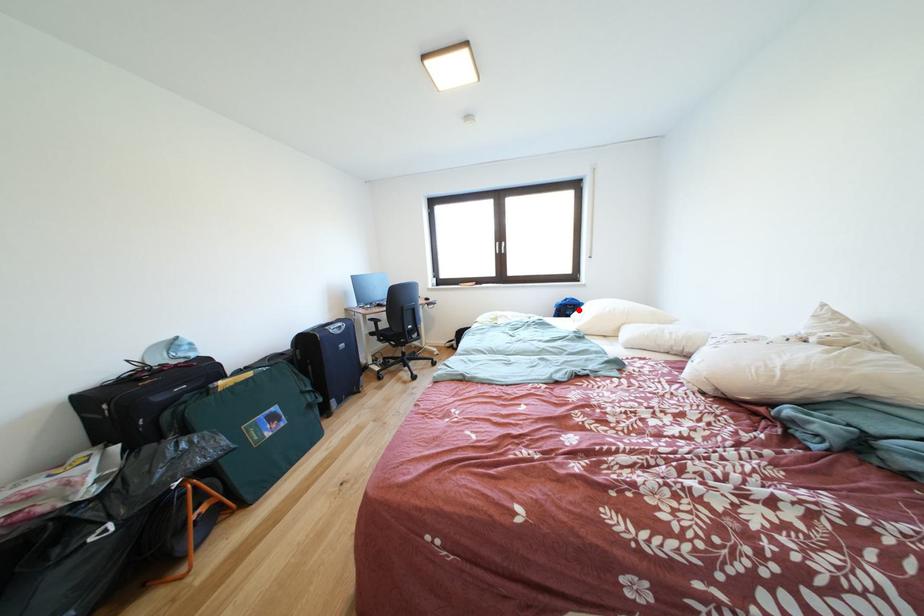
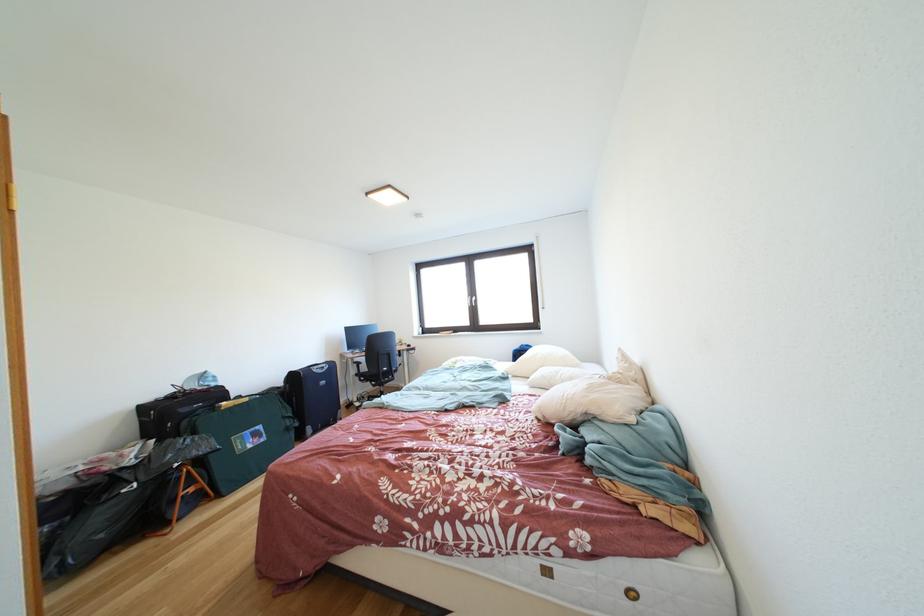
Question: I am providing you with two images of the same scene from different viewpoints. A red point is marked on the first image. At the location where the point appears in image 1, is it still visible in image 2?

Choices:
 (A) Yes
 (B) No

Answer: (B)